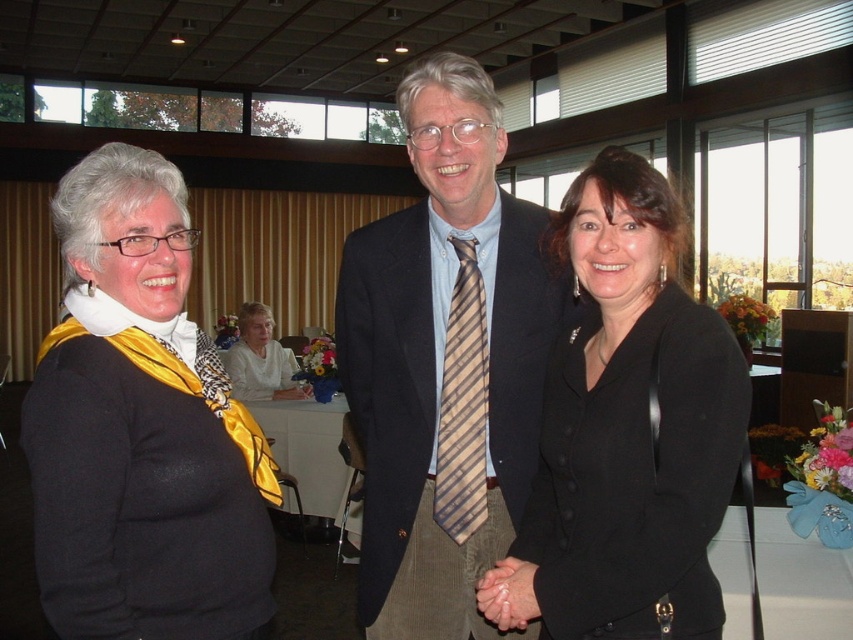
Between point (553, 273) and point (469, 356), which one is positioned behind?

The point (553, 273) is behind.

Where is `striped tie at center`? The width and height of the screenshot is (853, 640). striped tie at center is located at coordinates (444, 362).

What do you see at coordinates (627, 433) in the screenshot? The width and height of the screenshot is (853, 640). I see `black matte blazer at center` at bounding box center [627, 433].

Between black matte blazer at center and brown striped tie at center, which one has less height?

Standing shorter between the two is brown striped tie at center.

Between point (613, 224) and point (453, 540), which one is positioned in front?

Positioned in front is point (613, 224).

Identify the location of black matte blazer at center. This screenshot has height=640, width=853. (627, 433).

Between black matte scarf at left and black matte blazer at center, which one is positioned lower?

Positioned lower is black matte blazer at center.

Consider the image. Is black matte scarf at left below black matte blazer at center?

No.

Find the location of a particular element. black matte scarf at left is located at coordinates (138, 428).